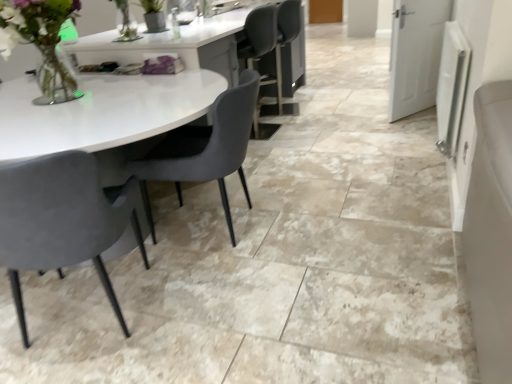
Where is `vacant space behind velvet grey chair at center, the 2th chair in the left-to-right sequence`? This screenshot has height=384, width=512. vacant space behind velvet grey chair at center, the 2th chair in the left-to-right sequence is located at coordinates (233, 185).